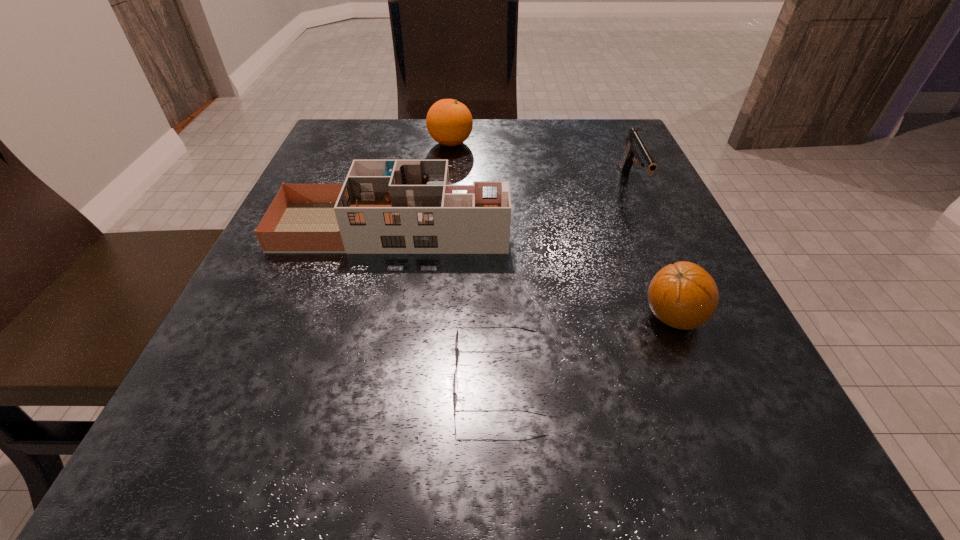
This screenshot has width=960, height=540. Identify the location of the farther orange. (449, 122).

Where is `the farthest object`? The image size is (960, 540). the farthest object is located at coordinates (449, 122).

Find the location of `pistol`. pistol is located at coordinates (636, 148).

The width and height of the screenshot is (960, 540). In order to click on dollhouse in this screenshot , I will do `click(384, 206)`.

Where is `the nearer orange`? This screenshot has height=540, width=960. the nearer orange is located at coordinates (683, 295).

Locate an element on the screen. This screenshot has height=540, width=960. sunglasses is located at coordinates (456, 338).

The height and width of the screenshot is (540, 960). I want to click on free spot located on the front of the farther orange, so click(x=438, y=267).

Where is `vacant space positioned 0.140m at the muzzle of the pistol`? This screenshot has width=960, height=540. vacant space positioned 0.140m at the muzzle of the pistol is located at coordinates (664, 258).

Locate an element on the screen. The height and width of the screenshot is (540, 960). free space located at the front door of the dollhouse is located at coordinates (621, 227).

This screenshot has width=960, height=540. What are the coordinates of `free location located 0.220m on the left of the right orange` in the screenshot? It's located at (487, 317).